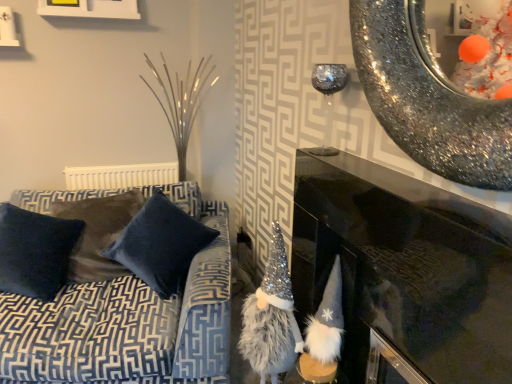
Question: From a real-world perspective, is velvet dark blue pillow at left, the first pillow in the left-to-right sequence, positioned above or below white matte picture frame at upper left?

Choices:
 (A) above
 (B) below

Answer: (B)

Question: In terms of size, does velvet dark blue pillow at left, the 2th pillow when ordered from right to left, appear bigger or smaller than white matte picture frame at upper left?

Choices:
 (A) small
 (B) big

Answer: (B)

Question: Which object is the farthest from the black glossy fireplace at center?

Choices:
 (A) fuzzy silver gnome at center
 (B) white plastic radiator at upper center
 (C) white fluffy gnome at lower right
 (D) velvet dark blue pillow at left, the first pillow in the left-to-right sequence
 (E) velvet blue pillow at center, which is the 2th pillow from left to right

Answer: (B)

Question: Estimate the real-world distances between objects in this image. Which object is farther from the fuzzy silver gnome at center?

Choices:
 (A) velvet blue couch at left
 (B) sparkly metallic bowl at upper right
 (C) white matte picture frame at upper left
 (D) white plastic radiator at upper center
 (E) velvet blue pillow at center, the 1th pillow positioned from the right

Answer: (C)